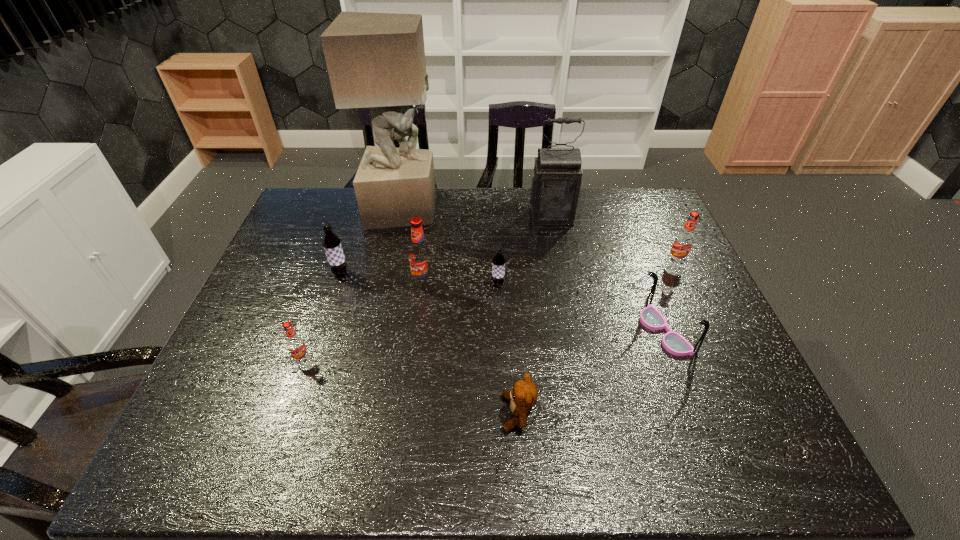
At what (x,y) coordinates should I click in order to perform the action: click on free space between the left brown root beer and the second red root beer from left to right. Please return your answer as a coordinate pair (x, y). The width and height of the screenshot is (960, 540). Looking at the image, I should click on (382, 278).

Identify the location of vacant point located between the bigger brown root beer and the lantern. This screenshot has width=960, height=540. (445, 245).

The image size is (960, 540). I want to click on vacant space in between the eighth object from left to right and the farthest red root beer, so click(670, 297).

The height and width of the screenshot is (540, 960). I want to click on free space between the brown teddy bear and the third root beer from left to right, so tap(470, 348).

This screenshot has width=960, height=540. What are the coordinates of `vacant point located between the third object from right to left and the bigger brown root beer` in the screenshot? It's located at (445, 245).

Identify the location of vacant area between the biggest red root beer and the bigger brown root beer. (382, 278).

Where is `free spot between the spectacles and the smaller brown root beer`? free spot between the spectacles and the smaller brown root beer is located at coordinates (581, 308).

This screenshot has height=540, width=960. Identify the location of object that can be found as the fifth closest to the right brown root beer. (650, 317).

Locate an element on the screen. object that stands as the closest to the eighth shortest object is located at coordinates (498, 262).

Locate which root beer is the fourth closest to the nearest red root beer. Please provide its 2D coordinates. Your answer should be formatted as a tuple, i.e. [(x, y)], where the tuple contains the x and y coordinates of a point satisfying the conditions above.

[(683, 242)]